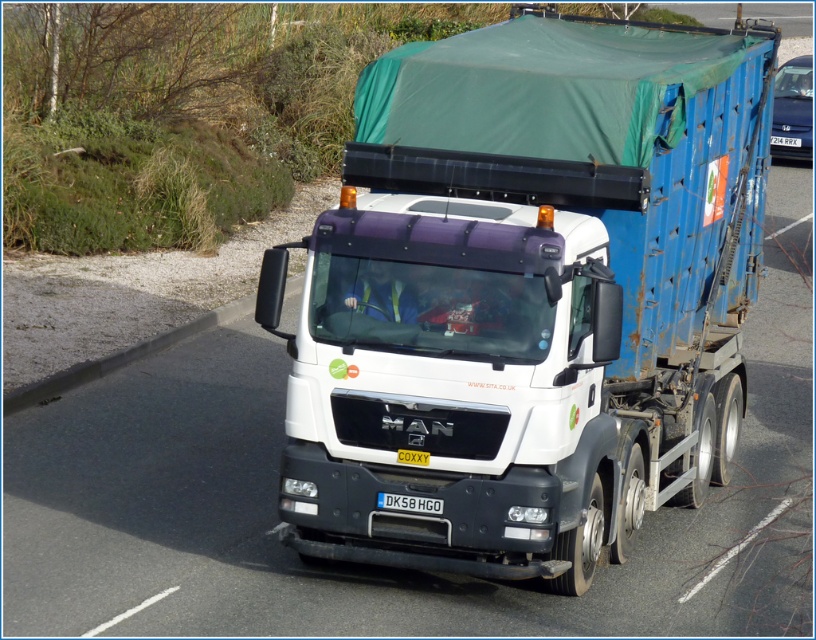
Who is taller, white matte trailer truck at center or yellow matte license plate at center?

With more height is white matte trailer truck at center.

Does white matte trailer truck at center have a greater height compared to yellow matte license plate at center?

Yes.

Between point (276, 262) and point (400, 458), which one is positioned in front?

Point (400, 458) is in front.

The height and width of the screenshot is (640, 816). I want to click on white matte trailer truck at center, so click(x=526, y=294).

Which is in front, point (415, 465) or point (794, 147)?

Point (415, 465) is in front.

The image size is (816, 640). Describe the element at coordinates (411, 456) in the screenshot. I see `yellow matte license plate at center` at that location.

Locate an element on the screen. The image size is (816, 640). yellow matte license plate at center is located at coordinates (411, 456).

Which is behind, point (690, 99) or point (797, 145)?

Point (797, 145)

Can you confirm if white matte trailer truck at center is taller than white plastic license plate at center?

No, white matte trailer truck at center is not taller than white plastic license plate at center.

Where is `white matte trailer truck at center`? The height and width of the screenshot is (640, 816). white matte trailer truck at center is located at coordinates (526, 294).